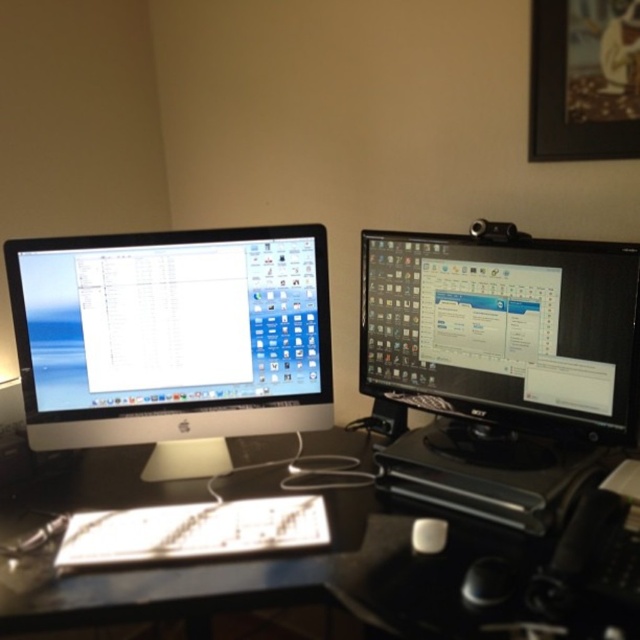
You are organizing your desk and want to place a new keyboard between the satin black monitor at left and the white matte mouse at center. Can you do this without moving the existing items?

The satin black monitor at left is above the white matte mouse at center, so you can place the keyboard between them horizontally as they are aligned vertically. However, ensure there is enough space on the desk surface between them for the keyboard.

Consider the image. You are trying to reach the black glossy monitor at right from the white matte mouse at center. In which direction should you move?

The black glossy monitor at right is to the right of the white matte mouse at center, so you should move to the right to reach it.